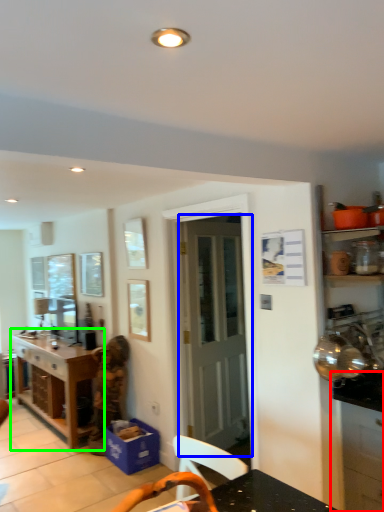
Question: Estimate the real-world distances between objects in this image. Which object is farther from cabinetry (highlighted by a red box), door (highlighted by a blue box) or table (highlighted by a green box)?

Choices:
 (A) door
 (B) table

Answer: (B)